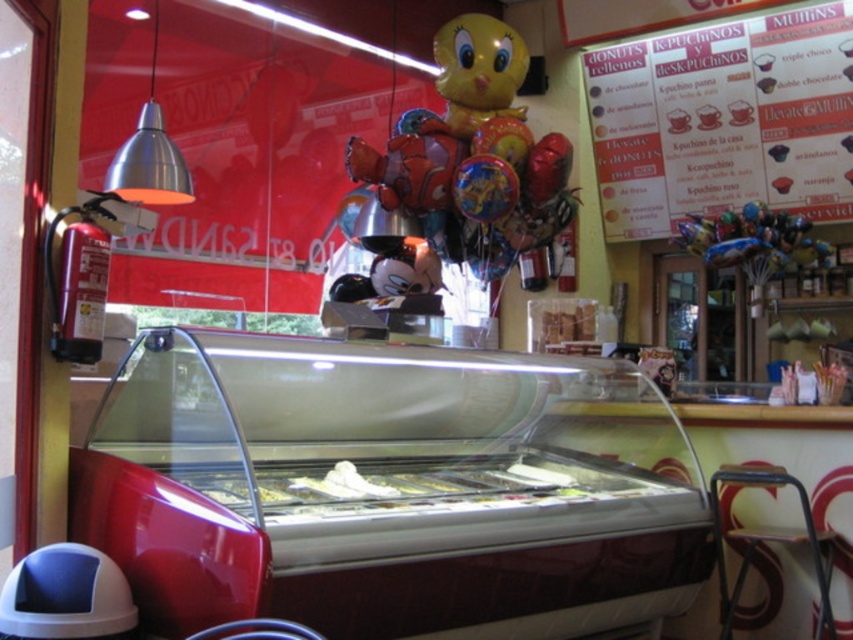
Based on the photo, how far apart are yellow metallic balloon at center and metallic silver stool at lower right?

yellow metallic balloon at center and metallic silver stool at lower right are 7.28 feet apart from each other.

Between point (451, 260) and point (824, 576), which one is positioned in front?

Point (824, 576) is in front.

The image size is (853, 640). I want to click on yellow metallic balloon at center, so click(473, 156).

Can you confirm if red paper poster at upper right is shorter than yellow metallic balloon at center?

Indeed, red paper poster at upper right has a lesser height compared to yellow metallic balloon at center.

Which is in front, point (593, 122) or point (527, 157)?

Point (527, 157) is in front.

The image size is (853, 640). I want to click on red paper poster at upper right, so click(x=724, y=120).

Can you confirm if red paper poster at upper right is wider than metallic silver stool at lower right?

Yes, red paper poster at upper right is wider than metallic silver stool at lower right.

Between red paper poster at upper right and metallic silver stool at lower right, which one is positioned lower?

Positioned lower is metallic silver stool at lower right.

Measure the distance between point (x=762, y=104) and camera.

Point (x=762, y=104) is 17.38 feet from camera.

At what (x,y) coordinates should I click in order to perform the action: click on red paper poster at upper right. Please return your answer as a coordinate pair (x, y). The height and width of the screenshot is (640, 853). Looking at the image, I should click on (724, 120).